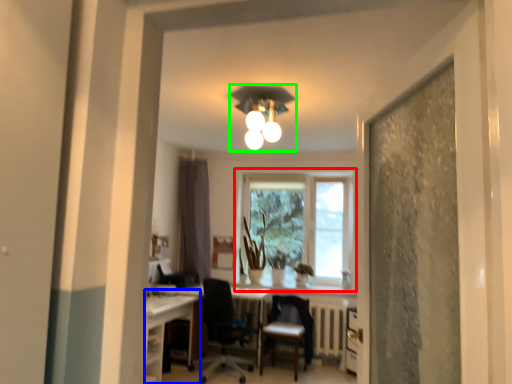
Question: Which is farther away from window (highlighted by a red box)? computer desk (highlighted by a blue box) or light fixture (highlighted by a green box)?

Choices:
 (A) computer desk
 (B) light fixture

Answer: (A)